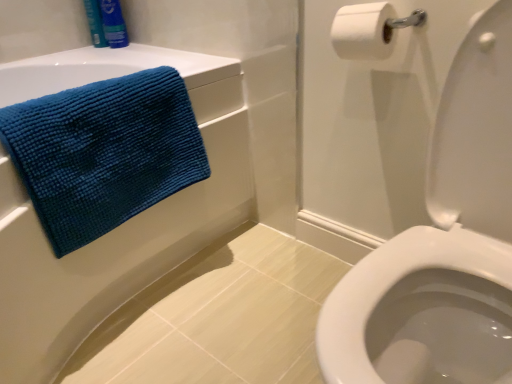
Question: From the image's perspective, is white matte toilet paper at upper right located above or below blue matte shampoo at upper left, the 2th toiletry from the right?

Choices:
 (A) above
 (B) below

Answer: (B)

Question: Relative to blue matte shampoo at upper left, the 2th toiletry from the right, is white matte toilet paper at upper right in front or behind?

Choices:
 (A) behind
 (B) front

Answer: (B)

Question: Which object is positioned farthest from the blue fabric shampoo at upper left, the 1th toiletry in the right-to-left sequence?

Choices:
 (A) blue textured towel at upper left
 (B) teal textured towel at left
 (C) white matte toilet paper at upper right
 (D) blue matte shampoo at upper left, marked as the 1th toiletry in a left-to-right arrangement
 (E) white glossy toilet seat at right

Answer: (E)

Question: Which is nearer to the blue matte shampoo at upper left, the 2th toiletry from the right?

Choices:
 (A) teal textured towel at left
 (B) blue fabric shampoo at upper left, the 1th toiletry in the right-to-left sequence
 (C) white glossy toilet seat at right
 (D) white matte toilet paper at upper right
 (E) blue textured towel at upper left

Answer: (B)